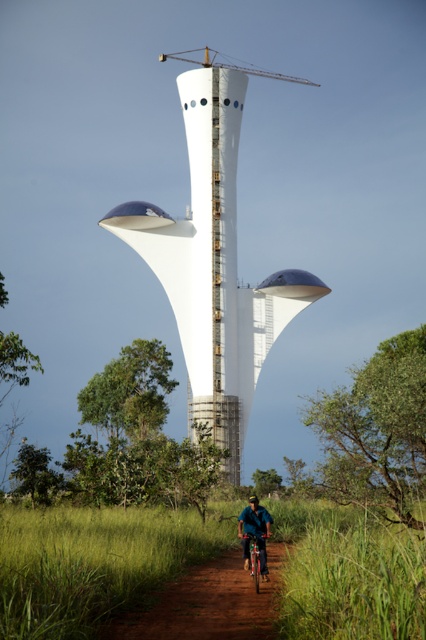
What are the coordinates of the brown dirt track at center?

The brown dirt track at center is located at coordinates point (x=207, y=604).

You are standing in front of the futuristic tower and want to determine the relative positions of two points marked on the structure. Which point, point (236, 276) or point (250, 566), is closer to you?

Point (236, 276) is closer to you because it is further to the viewer than point (250, 566).